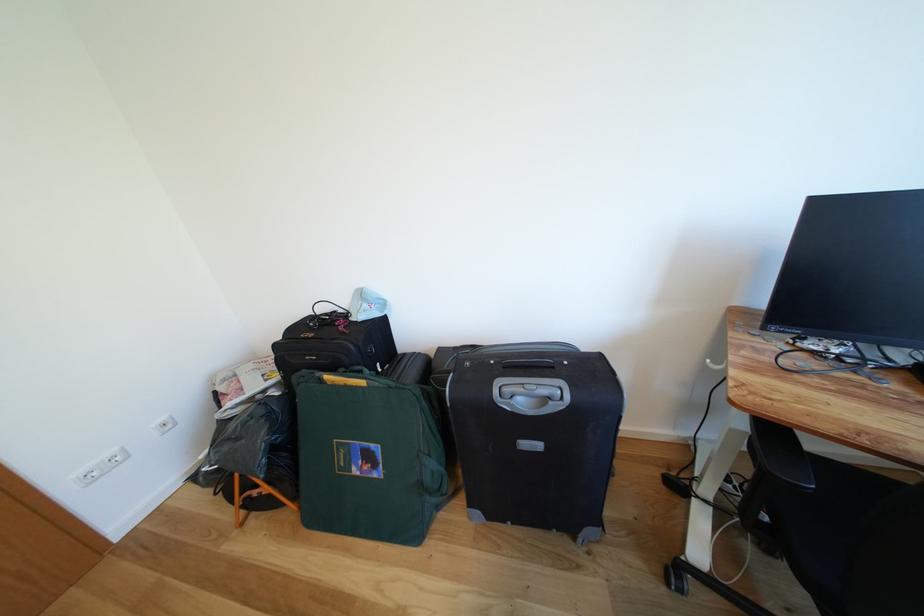
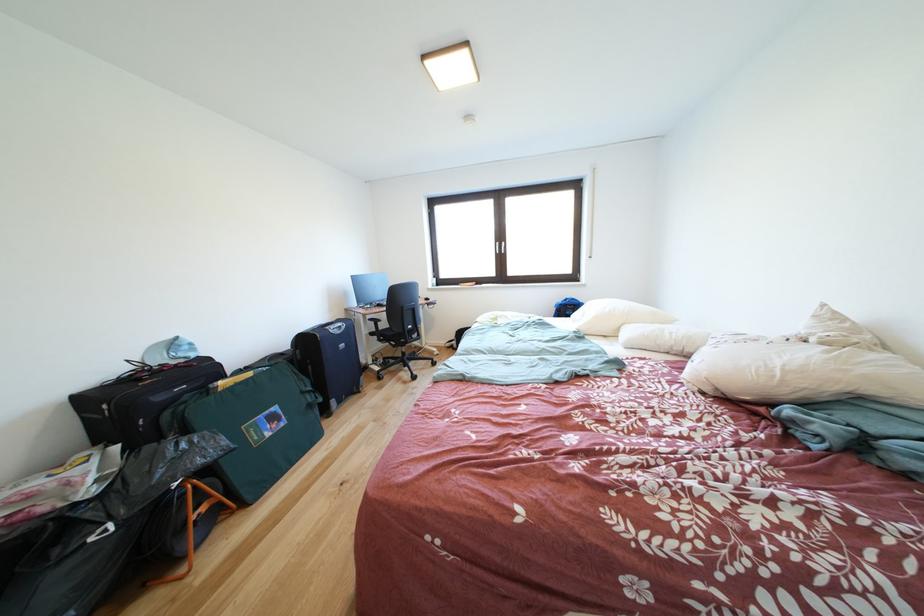
In the second image, find the point that corresponds to point (371, 387) in the first image.

(259, 379)